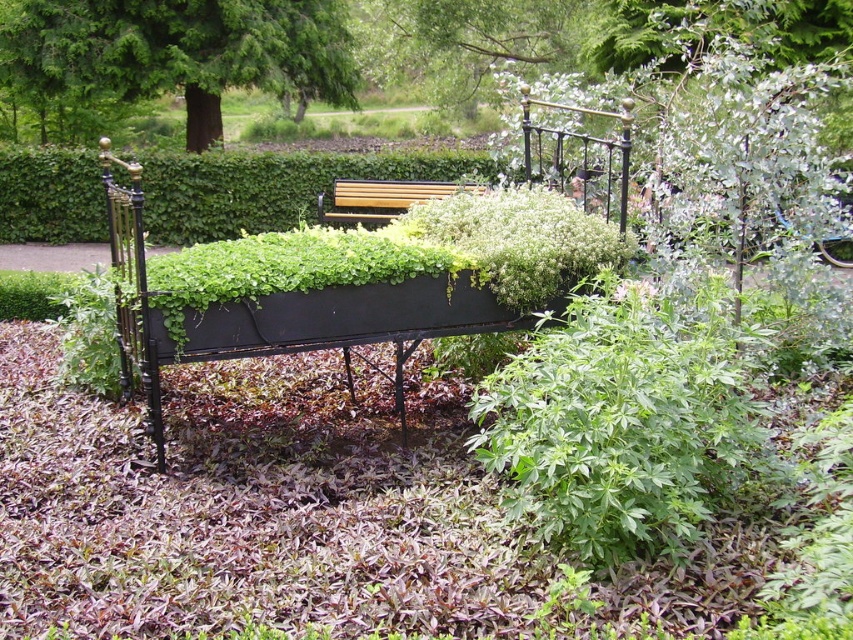
Question: Which point appears farthest from the camera in this image?

Choices:
 (A) (318, 168)
 (B) (170, 48)

Answer: (B)

Question: Is black metal bench at center above green leafy hedge at center?

Choices:
 (A) no
 (B) yes

Answer: (A)

Question: Can you confirm if green leafy bush at center is bigger than green leafy tree at upper left?

Choices:
 (A) yes
 (B) no

Answer: (B)

Question: Estimate the real-world distances between objects in this image. Which object is closer to the green leafy bush at center?

Choices:
 (A) green leafy hedge at center
 (B) green leafy tree at upper left

Answer: (A)

Question: Which of these objects is positioned closest to the black metal bench at center?

Choices:
 (A) wooden bench at center
 (B) green leafy tree at upper left
 (C) green leafy hedge at center

Answer: (A)

Question: Observing the image, what is the correct spatial positioning of black metal bench at center in reference to wooden bench at center?

Choices:
 (A) below
 (B) above

Answer: (A)